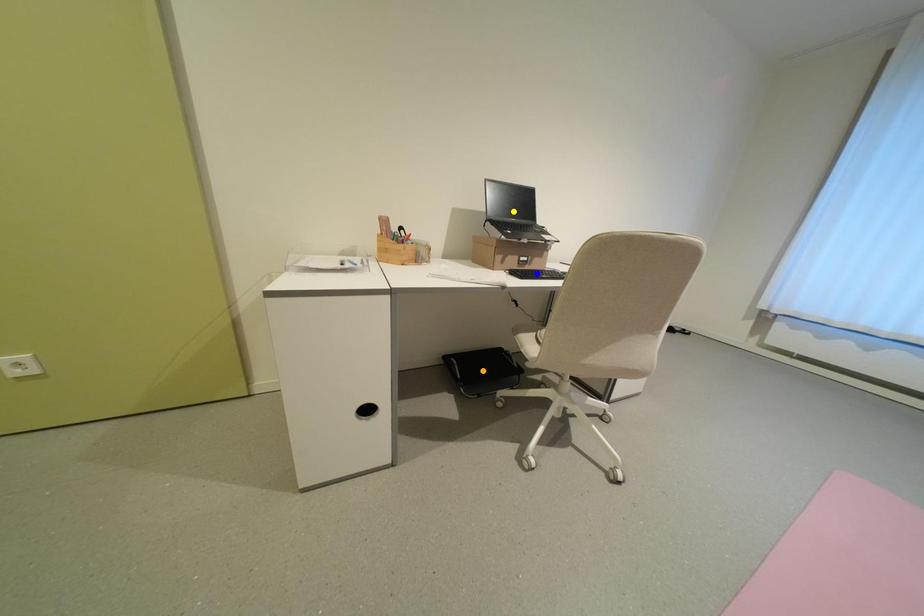
Order these from nearest to farthest:
yellow point
blue point
orange point

blue point
yellow point
orange point